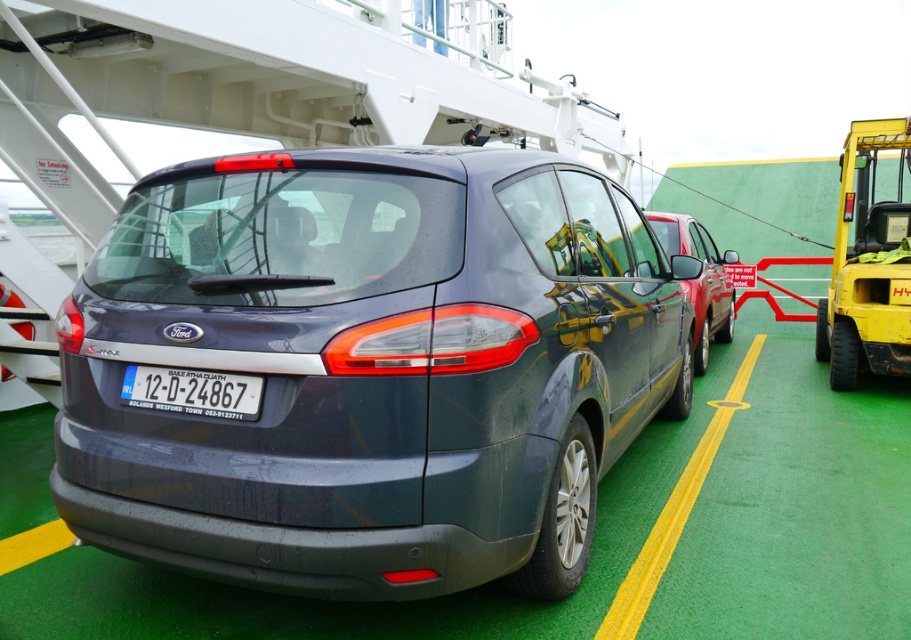
Question: Is yellow rubber tire at right smaller than metallic red car at center?

Choices:
 (A) yes
 (B) no

Answer: (B)

Question: Considering the relative positions of satin dark gray car at center and yellow rubber tire at right in the image provided, where is satin dark gray car at center located with respect to yellow rubber tire at right?

Choices:
 (A) left
 (B) right

Answer: (A)

Question: Which is nearer to the satin dark gray car at center?

Choices:
 (A) white plastic license plate at center
 (B) metallic red car at center

Answer: (A)

Question: Which is nearer to the satin dark gray car at center?

Choices:
 (A) metallic red car at center
 (B) white plastic license plate at center

Answer: (B)

Question: Is satin dark gray car at center below metallic red car at center?

Choices:
 (A) yes
 (B) no

Answer: (A)

Question: Which point is farther to the camera?

Choices:
 (A) (56, 493)
 (B) (156, 371)
 (C) (707, 291)

Answer: (C)